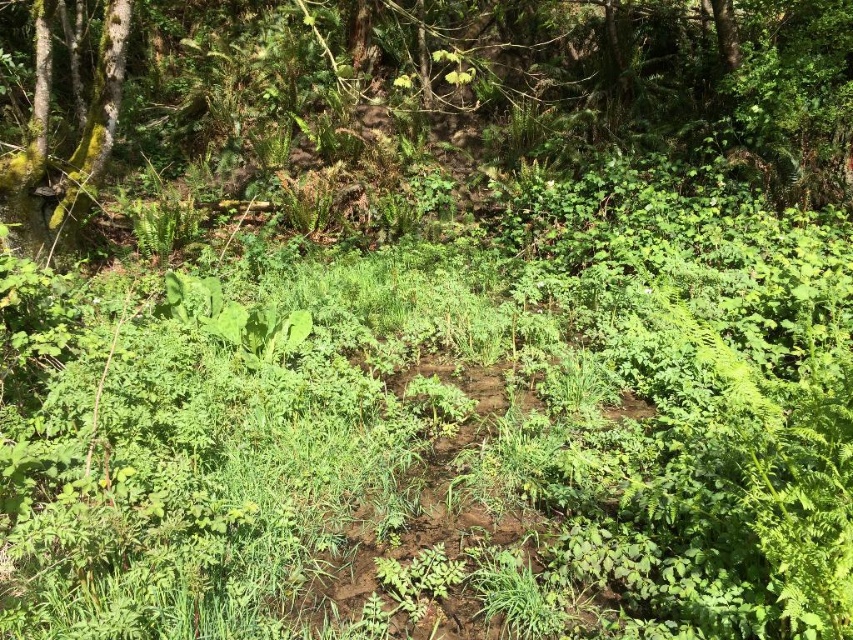
Does green leafy tree at upper center appear under green mossy tree at upper left?

Actually, green leafy tree at upper center is above green mossy tree at upper left.

Between point (704, 12) and point (44, 29), which one is positioned behind?

Point (704, 12)

I want to click on green leafy tree at upper center, so click(422, 88).